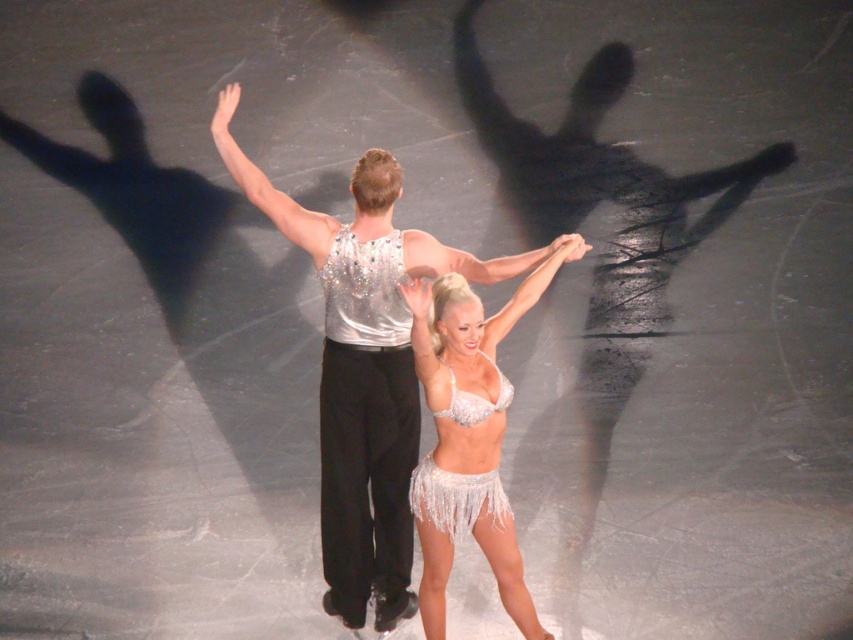
Which of these two, silver sparkly tank top at center or sequined white skirt at center, stands taller?

silver sparkly tank top at center is taller.

Image resolution: width=853 pixels, height=640 pixels. I want to click on silver sparkly tank top at center, so click(x=364, y=368).

Find the location of a particular element. The width and height of the screenshot is (853, 640). silver sparkly tank top at center is located at coordinates (364, 368).

Measure the distance between point (393,374) and camera.

4.08 meters

Is point (265, 182) positioned in front of point (445, 547)?

Yes.

Between point (404, 381) and point (426, 544), which one is positioned in front?

Point (426, 544)

You are a GUI agent. You are given a task and a screenshot of the screen. Output one action in this format:
    pyautogui.click(x=<x>, y=<y>)
    Task: Click on the silver sparkly tank top at center
    The image size is (853, 640).
    Given the screenshot: What is the action you would take?
    pyautogui.click(x=364, y=368)

Looking at this image, does sparkly silver bikini at center lie in front of white sequined skirt at center?

Yes, it is in front of white sequined skirt at center.

Is point (477, 465) positioned before point (445, 508)?

Yes, point (477, 465) is closer to viewer.

Image resolution: width=853 pixels, height=640 pixels. I want to click on sparkly silver bikini at center, so click(469, 362).